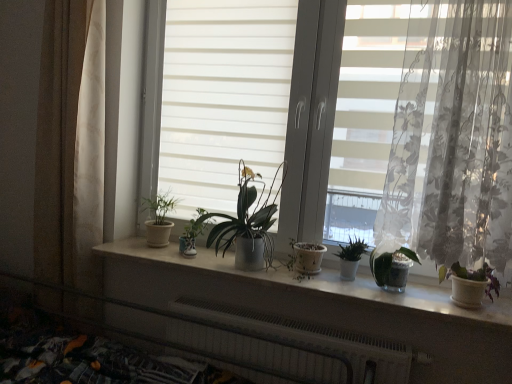
At what (x,y) coordinates should I click in order to perform the action: click on vacant region under matte white pot at center, the fourth houseplant positioned from the right (from a real-world perspective). Please return your answer as a coordinate pair (x, y). The image size is (512, 384). Looking at the image, I should click on pos(242,263).